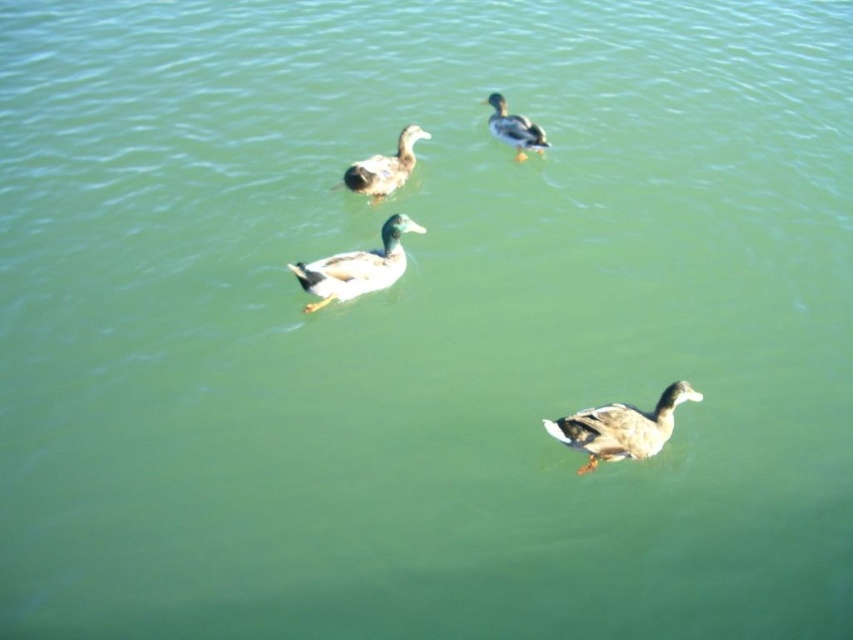
Question: Which point is farther to the camera?

Choices:
 (A) (329, 273)
 (B) (602, 422)
 (C) (512, 132)
 (D) (378, 192)

Answer: (C)

Question: Is dark brown feathers at lower right bigger than green glossy duck at upper center?

Choices:
 (A) no
 (B) yes

Answer: (A)

Question: From the image, what is the correct spatial relationship of dark brown feathers at lower right in relation to brown matte duck at center?

Choices:
 (A) left
 (B) right

Answer: (B)

Question: Is green matte duck at center above brown matte duck at center?

Choices:
 (A) yes
 (B) no

Answer: (B)

Question: Which is farther from the dark brown feathers at lower right?

Choices:
 (A) green glossy duck at upper center
 (B) green matte duck at center

Answer: (A)

Question: Considering the real-world distances, which object is closest to the green matte duck at center?

Choices:
 (A) green glossy duck at upper center
 (B) brown matte duck at center
 (C) dark brown feathers at lower right

Answer: (B)